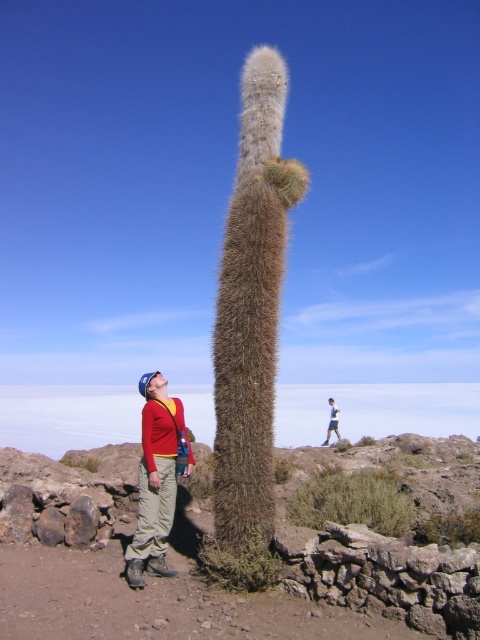
Is red wool sweater at lower left taller than light blue denim jacket at lower center?

Indeed, red wool sweater at lower left has a greater height compared to light blue denim jacket at lower center.

Between point (148, 413) and point (336, 419), which one is positioned in front?

Positioned in front is point (148, 413).

Who is more forward, (x=132, y=588) or (x=336, y=420)?

Point (x=132, y=588) is in front.

Identify the location of red wool sweater at lower left. (156, 477).

Does fuzzy brown cactus at center appear on the right side of red wool sweater at lower left?

Indeed, fuzzy brown cactus at center is positioned on the right side of red wool sweater at lower left.

Does point (227, 225) come farther from viewer compared to point (167, 472)?

Yes, point (227, 225) is behind point (167, 472).

This screenshot has height=640, width=480. Find the location of `fuzzy brown cactus at center`. fuzzy brown cactus at center is located at coordinates (251, 332).

I want to click on fuzzy brown cactus at center, so click(251, 332).

What do you see at coordinates (217, 586) in the screenshot?
I see `green spiky cactus at center` at bounding box center [217, 586].

Image resolution: width=480 pixels, height=640 pixels. Identify the location of green spiky cactus at center. (217, 586).